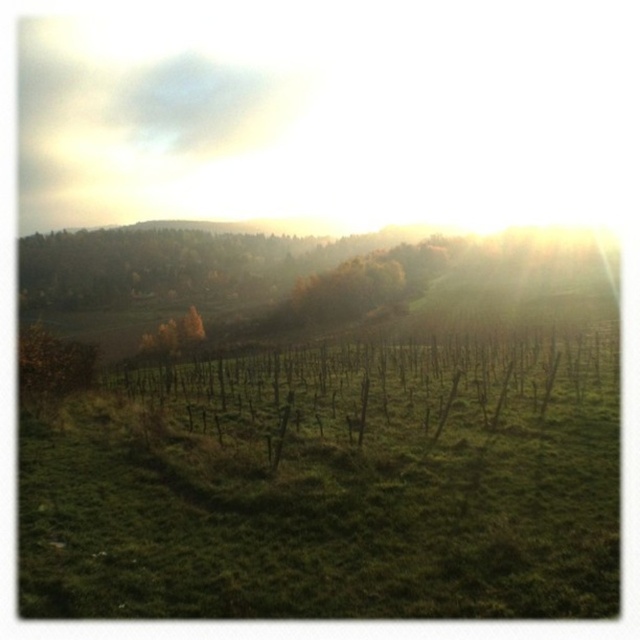
You are standing at the point with coordinates point [147,344] and want to walk towards the point with coordinates point [330,481]. Which direction should you move relative to your current position?

You should move forward because point [330,481] is in front of point [147,344].

You are standing at the edge of the green grassy field at center and want to walk towards the green leafy tree at left. Which direction should you go?

You should walk to the left because the green grassy field at center is to the right of the green leafy tree at left, meaning the tree is located to your left side.